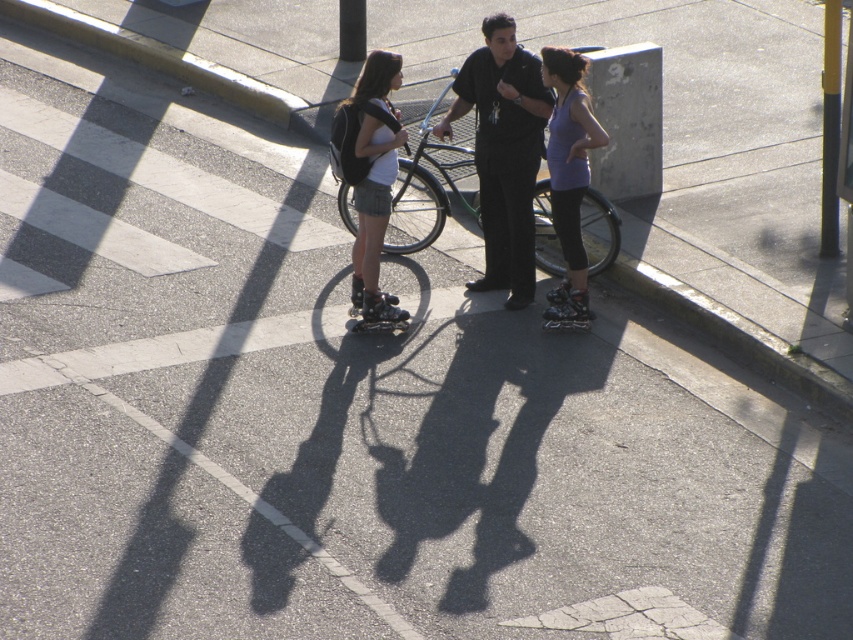
You are a fashion designer observing the two shirts in the scene. Which of the two shirts, the black smooth shirt at center or the purple matte tank top at center, has a larger size?

The black smooth shirt at center is larger in size than the purple matte tank top at center.

You are a photographer standing on the sidewalk and want to take a photo of both the black smooth shirt at center and the purple matte tank top at center. Which one should you focus on first to ensure it appears clearer in the photo?

The black smooth shirt at center is further to the viewer than the purple matte tank top at center, so you should focus on the black smooth shirt at center first to ensure it appears clearer in the photo.